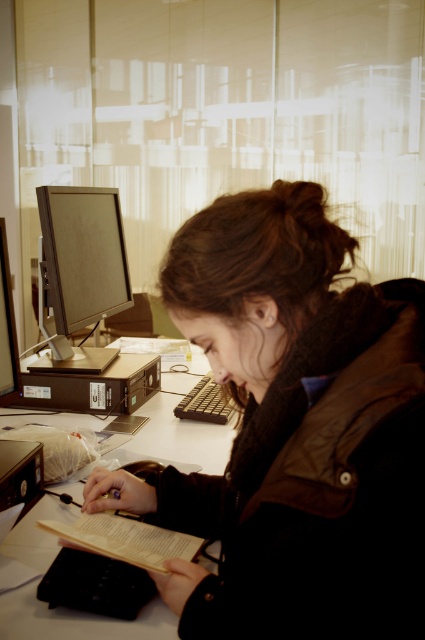
Question: Which of the following is the farthest from the observer?

Choices:
 (A) (61, 515)
 (B) (132, 524)
 (C) (303, 509)

Answer: (A)

Question: Is matte black monitor at left to the right of light brown paper book at lower center from the viewer's perspective?

Choices:
 (A) no
 (B) yes

Answer: (A)

Question: Estimate the real-world distances between objects in this image. Which object is farther from the dark brown knit scarf at center?

Choices:
 (A) white plastic computer desk at center
 (B) matte black monitor at left

Answer: (B)

Question: Estimate the real-world distances between objects in this image. Which object is farther from the dark brown knit scarf at center?

Choices:
 (A) matte black monitor at left
 (B) light brown paper book at lower center

Answer: (A)

Question: Is white plastic computer desk at center above light brown paper book at lower center?

Choices:
 (A) yes
 (B) no

Answer: (A)

Question: Can you confirm if dark brown knit scarf at center is positioned to the right of light brown paper book at lower center?

Choices:
 (A) no
 (B) yes

Answer: (B)